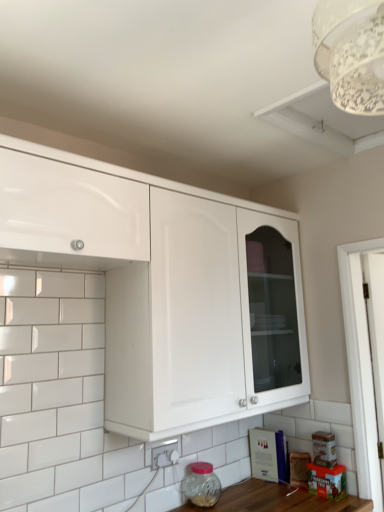
Question: Is white glossy electric outlet at lower center directly adjacent to white lace lampshade at upper right?

Choices:
 (A) no
 (B) yes

Answer: (A)

Question: Is white glossy electric outlet at lower center turned away from white lace lampshade at upper right?

Choices:
 (A) yes
 (B) no

Answer: (B)

Question: Is white glossy electric outlet at lower center closer to the viewer compared to white lace lampshade at upper right?

Choices:
 (A) no
 (B) yes

Answer: (A)

Question: Is white lace lampshade at upper right a part of white glossy electric outlet at lower center?

Choices:
 (A) no
 (B) yes

Answer: (A)

Question: From the image's perspective, is white glossy electric outlet at lower center under white lace lampshade at upper right?

Choices:
 (A) yes
 (B) no

Answer: (A)

Question: Does white glossy electric outlet at lower center have a greater height compared to white lace lampshade at upper right?

Choices:
 (A) no
 (B) yes

Answer: (A)

Question: Considering the relative positions of white glossy cabinet at upper left, the first cabinetry positioned from the left, and transparent glass jar at lower center in the image provided, is white glossy cabinet at upper left, the first cabinetry positioned from the left, to the right of transparent glass jar at lower center from the viewer's perspective?

Choices:
 (A) no
 (B) yes

Answer: (A)

Question: Does white glossy cabinet at upper left, the first cabinetry positioned from the left, touch transparent glass jar at lower center?

Choices:
 (A) no
 (B) yes

Answer: (A)

Question: Does white glossy cabinet at upper left, acting as the 2th cabinetry starting from the right, have a greater width compared to transparent glass jar at lower center?

Choices:
 (A) yes
 (B) no

Answer: (A)

Question: Considering the relative positions of white glossy cabinet at upper left, acting as the 2th cabinetry starting from the right, and transparent glass jar at lower center in the image provided, is white glossy cabinet at upper left, acting as the 2th cabinetry starting from the right, to the left of transparent glass jar at lower center from the viewer's perspective?

Choices:
 (A) no
 (B) yes

Answer: (B)

Question: From the image's perspective, is white glossy cabinet at upper left, the first cabinetry positioned from the left, on top of transparent glass jar at lower center?

Choices:
 (A) no
 (B) yes

Answer: (B)

Question: From the image's perspective, is white glossy cabinet at upper left, the first cabinetry positioned from the left, located beneath transparent glass jar at lower center?

Choices:
 (A) yes
 (B) no

Answer: (B)

Question: Is transparent glass jar at lower center shorter than white glossy cabinet at upper center, which appears as the first cabinetry when viewed from the right?

Choices:
 (A) no
 (B) yes

Answer: (B)